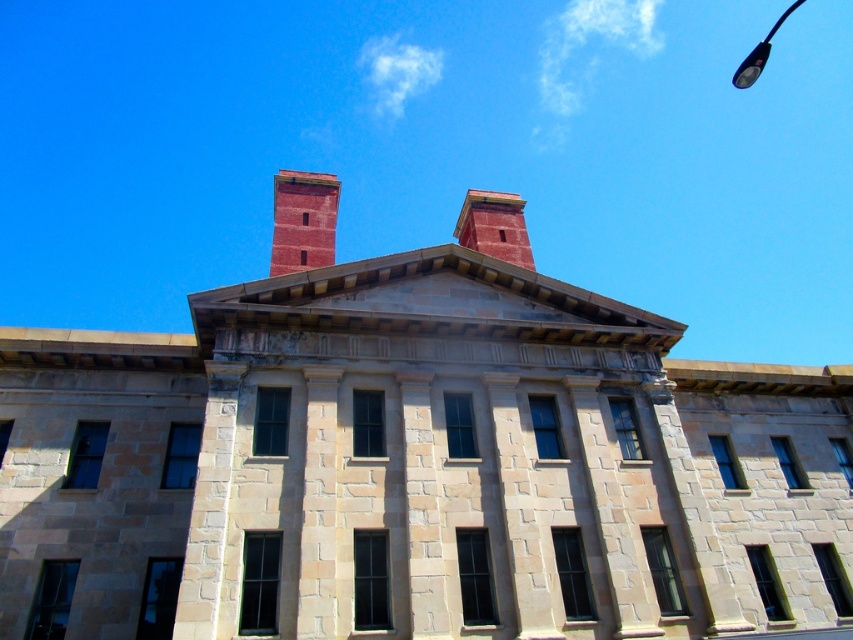
You are an architect analyzing the symmetry of the building. Given the brick chimney at center and the metallic pole at upper right, which object takes up more visual space in the composition?

The metallic pole at upper right takes up more visual space than the brick chimney at center, as the brick chimney at center occupies less space than metallic pole at upper right.